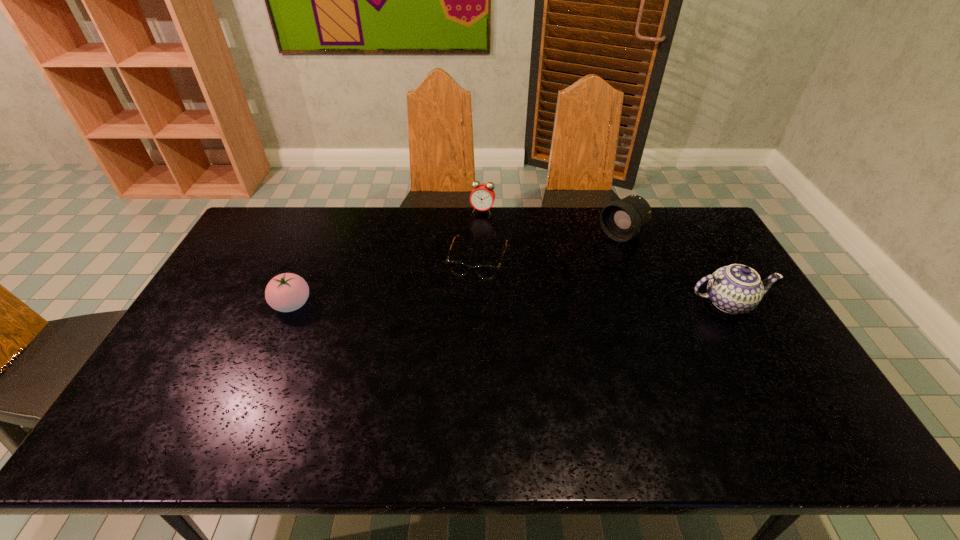
This screenshot has width=960, height=540. In order to click on vacant space at the far edge of the desktop in this screenshot , I will do click(x=358, y=213).

Where is `vacant area at the near edge of the desktop`? The width and height of the screenshot is (960, 540). vacant area at the near edge of the desktop is located at coordinates (257, 395).

This screenshot has width=960, height=540. In the image, there is a desktop. What are the coordinates of `vacant space at the left edge` in the screenshot? It's located at (218, 322).

You are a GUI agent. You are given a task and a screenshot of the screen. Output one action in this format:
    pyautogui.click(x=<x>, y=<y>)
    Task: Click on the free spot at the right edge of the desktop
    
    Given the screenshot: What is the action you would take?
    pyautogui.click(x=778, y=341)

In the image, there is a desktop. In order to click on free region at the far left corner in this screenshot , I will do `click(263, 218)`.

At what (x,y) coordinates should I click in order to perform the action: click on blank space at the far right corner of the desktop. Please return your answer as a coordinate pair (x, y). Looking at the image, I should click on (667, 210).

Locate an element on the screen. vacant space at the near right corner of the desktop is located at coordinates (757, 394).

This screenshot has height=540, width=960. I want to click on free space between the chinaware and the spectacles, so point(603,281).

Where is `free point between the telephoto lens and the rightmost object`? This screenshot has height=540, width=960. free point between the telephoto lens and the rightmost object is located at coordinates point(675,269).

What are the coordinates of `vacant space that is in between the chinaware and the spectacles` in the screenshot? It's located at click(x=603, y=281).